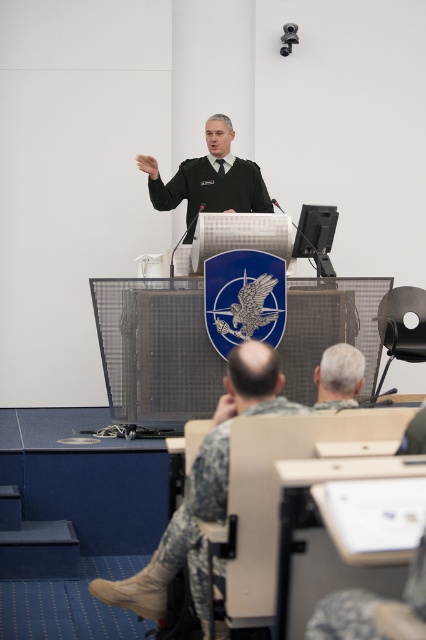
You are a photographer taking a group photo of the scene. You need to ensure that both the camouflage fabric uniform at lower center and the gray matte hair at center are clearly visible. Which object should you focus on first to ensure proper exposure, considering their sizes?

The camouflage fabric uniform at lower center is larger in size than the gray matte hair at center, so you should focus on the camouflage fabric uniform at lower center first to ensure proper exposure since it occupies more of the frame.

From the picture: You are an observer in the room. You notice the green uniform at center and the gray matte hair at center. Which one takes up more visual space in the image?

The green uniform at center has a larger size compared to gray matte hair at center, so it takes up more visual space in the image.